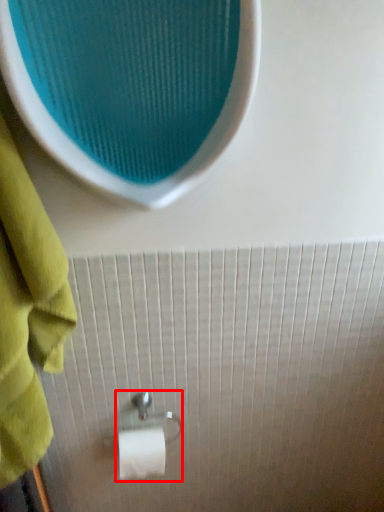
Question: In this image, where is towel bar (annotated by the red box) located relative to towel?

Choices:
 (A) left
 (B) right

Answer: (B)